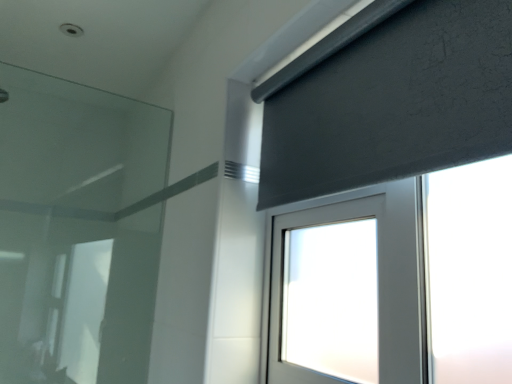
Question: Based on their sizes in the image, would you say transparent glass at left is bigger or smaller than dark gray textured curtain at upper right?

Choices:
 (A) big
 (B) small

Answer: (A)

Question: In terms of height, does transparent glass at left look taller or shorter compared to dark gray textured curtain at upper right?

Choices:
 (A) short
 (B) tall

Answer: (B)

Question: Looking at their shapes, would you say transparent glass at left is wider or thinner than dark gray textured curtain at upper right?

Choices:
 (A) thin
 (B) wide

Answer: (A)

Question: Is point (390, 43) positioned closer to the camera than point (75, 225)?

Choices:
 (A) closer
 (B) farther

Answer: (A)

Question: In the image, is dark gray textured curtain at upper right positioned in front of or behind transparent glass at left?

Choices:
 (A) behind
 (B) front

Answer: (B)

Question: Based on their sizes in the image, would you say dark gray textured curtain at upper right is bigger or smaller than transparent glass at left?

Choices:
 (A) small
 (B) big

Answer: (A)

Question: Is dark gray textured curtain at upper right taller or shorter than transparent glass at left?

Choices:
 (A) short
 (B) tall

Answer: (A)